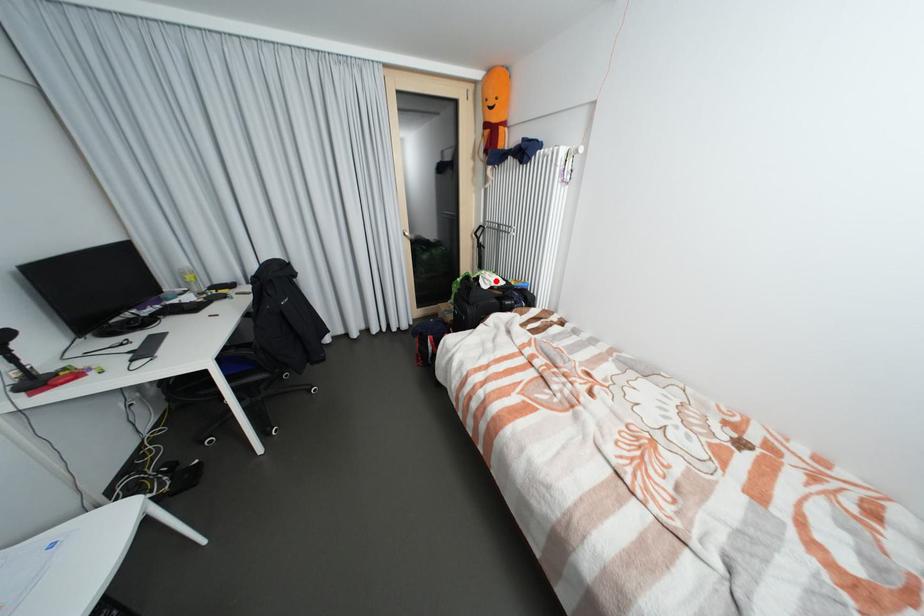
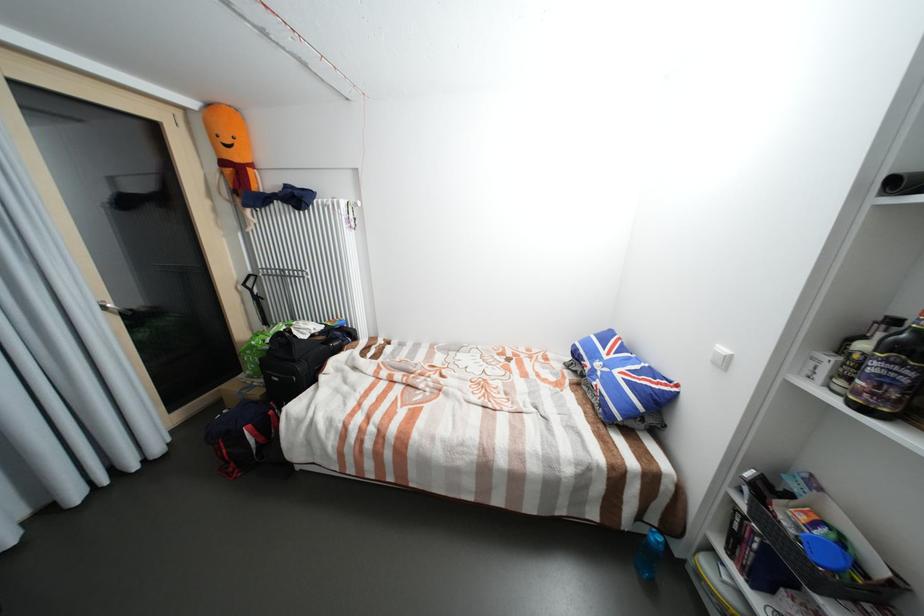
Question: I am providing you with two images of the same scene from different viewpoints. In image1, a red point is highlighted. Considering the same 3D point in image2, which of the following is correct?

Choices:
 (A) It is closer
 (B) It is farther

Answer: (A)